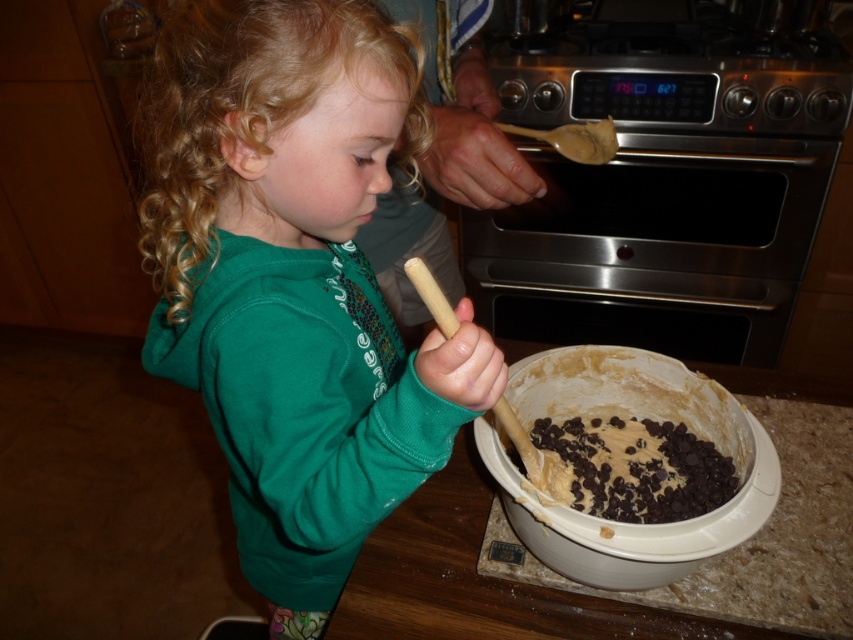
You are a chef standing at the kitchen counter and want to check the consistency of the dark brown dough at center. The camera is positioned where you are standing. If your arm can reach 34 inches, can you comfortably reach the dough to touch it?

The dark brown dough at center and camera are 34.13 inches apart from each other. Since your arm can reach 34 inches, you can almost reach the dough but might need to stretch slightly to touch it.

You are taking a photo of the kitchen scene. You want to focus on the point at the center of the image. Which point, point at (340, 304) or point at (700, 381), is closer to the camera and thus in better focus?

Point at (340, 304) is closer to the camera than point at (700, 381), so it will be in better focus.